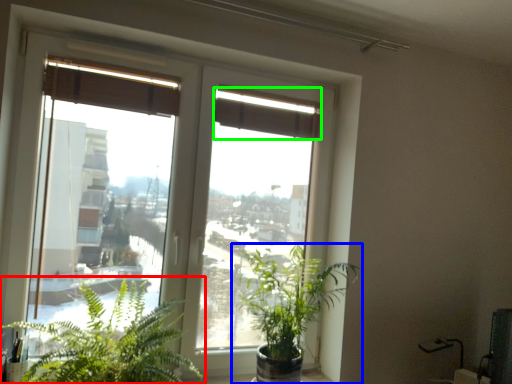
Question: Estimate the real-world distances between objects in this image. Which object is closer to houseplant (highlighted by a red box), houseplant (highlighted by a blue box) or curtain (highlighted by a green box)?

Choices:
 (A) houseplant
 (B) curtain

Answer: (A)